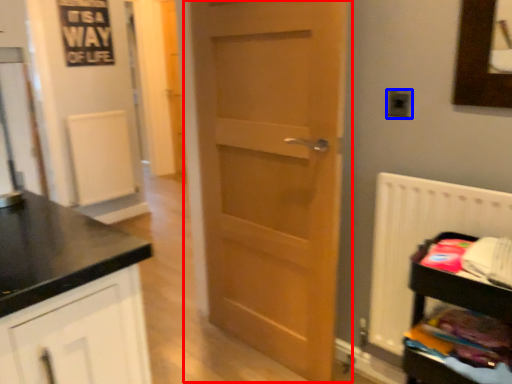
Question: Among these objects, which one is nearest to the camera, door (highlighted by a red box) or electric outlet (highlighted by a blue box)?

Choices:
 (A) door
 (B) electric outlet

Answer: (A)